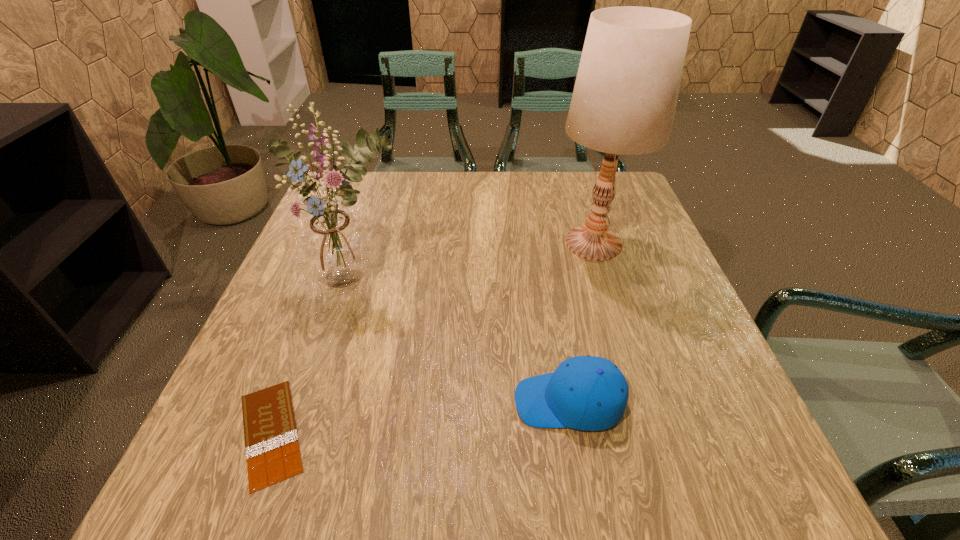
Image resolution: width=960 pixels, height=540 pixels. In order to click on vacant space that satisfies the following two spatial constraints: 1. on the front side of the tallest object; 2. on the front-facing side of the second shortest object in this screenshot , I will do `click(642, 402)`.